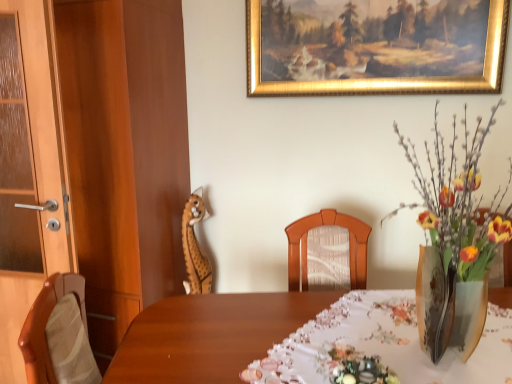
This screenshot has width=512, height=384. What do you see at coordinates (97, 159) in the screenshot?
I see `matte wood dresser at left` at bounding box center [97, 159].

What is the approximate width of wooden door at left?

wooden door at left is 18.51 centimeters in width.

Identify the location of wooden door at left. (30, 171).

You are a GUI agent. You are given a task and a screenshot of the screen. Output one action in this format:
    pyautogui.click(x=<x>, y=<y>)
    Task: Click on the translucent glass vase at right
    This screenshot has height=384, width=512.
    Given the screenshot: What is the action you would take?
    pyautogui.click(x=453, y=236)

The height and width of the screenshot is (384, 512). Find the location of `gold-framed painting at upper center`. gold-framed painting at upper center is located at coordinates (376, 51).

Where is `floral arrangement that is above the wooden door at left (from a real-world perspective)`? The width and height of the screenshot is (512, 384). floral arrangement that is above the wooden door at left (from a real-world perspective) is located at coordinates (453, 236).

Consider the image. Between wooden door at left and translucent glass vase at right, which one appears on the right side from the viewer's perspective?

From the viewer's perspective, translucent glass vase at right appears more on the right side.

Is there a large distance between wooden door at left and translucent glass vase at right?

Yes, wooden door at left is far from translucent glass vase at right.

From the image's perspective, who appears lower, wooden door at left or translucent glass vase at right?

From the image's view, wooden door at left is below.

Considering the positions of objects wooden table at center and wooden door at left in the image provided, who is behind, wooden table at center or wooden door at left?

wooden door at left is further from the camera.

Locate an element on the screen. Image resolution: width=512 pixels, height=384 pixels. table located underneath the wooden door at left (from a real-world perspective) is located at coordinates (209, 335).

From a real-world perspective, between wooden table at center and wooden door at left, who is vertically lower?

From a 3D spatial view, wooden table at center is below.

Which of these two, wooden table at center or wooden door at left, is thinner?

With smaller width is wooden door at left.

In the scene shown: From the image's perspective, which is below, wooden giraffe at upper left or translucent glass vase at right?

wooden giraffe at upper left appears lower in the image.

Find the location of a particular element. The image size is (512, 384). animal located underneath the translucent glass vase at right (from a real-world perspective) is located at coordinates (195, 247).

Does wooden giraffe at upper left touch translucent glass vase at right?

wooden giraffe at upper left and translucent glass vase at right are not in contact.

Looking at their sizes, would you say wooden giraffe at upper left is wider or thinner than translucent glass vase at right?

Considering their sizes, wooden giraffe at upper left looks slimmer than translucent glass vase at right.

Is point (478, 159) less distant than point (336, 292)?

Yes, point (478, 159) is in front of point (336, 292).

Which of these two, translucent glass vase at right or wooden table at center, stands shorter?

wooden table at center.

Considering the sizes of objects translucent glass vase at right and wooden table at center in the image provided, who is thinner, translucent glass vase at right or wooden table at center?

translucent glass vase at right.

Would you say wooden giraffe at upper left is a long distance from wooden table at center?

No, wooden giraffe at upper left is not far from wooden table at center.

The image size is (512, 384). In order to click on table in front of the wooden giraffe at upper left in this screenshot , I will do (x=209, y=335).

Considering the relative sizes of wooden giraffe at upper left and wooden table at center in the image provided, is wooden giraffe at upper left smaller than wooden table at center?

Correct, wooden giraffe at upper left occupies less space than wooden table at center.

Which point is more forward, (193, 199) or (258, 312)?

The point (258, 312) is more forward.

Can you see matte wood dresser at left touching translucent glass vase at right?

No, matte wood dresser at left is not in contact with translucent glass vase at right.

How many degrees apart are the facing directions of matte wood dresser at left and translucent glass vase at right?

matte wood dresser at left and translucent glass vase at right are facing 17.5 degrees away from each other.

Which of these two, matte wood dresser at left or translucent glass vase at right, is thinner?

matte wood dresser at left.

Which of these two, matte wood dresser at left or translucent glass vase at right, is smaller?

Smaller between the two is translucent glass vase at right.

Is matte wood dresser at left closer to the viewer compared to gold-framed painting at upper center?

No, matte wood dresser at left is further to the viewer.

Where is `dresser below the gold-framed painting at upper center (from the image's perspective)`? dresser below the gold-framed painting at upper center (from the image's perspective) is located at coordinates [x=97, y=159].

Considering the sizes of objects matte wood dresser at left and gold-framed painting at upper center in the image provided, who is thinner, matte wood dresser at left or gold-framed painting at upper center?

With smaller width is gold-framed painting at upper center.

Is there a large distance between matte wood dresser at left and gold-framed painting at upper center?

No.

Find the location of a particular element. door on the left side of translucent glass vase at right is located at coordinates (30, 171).

In the image, there is a wooden door at left. Find the location of `table below it (from a real-world perspective)`. table below it (from a real-world perspective) is located at coordinates (209, 335).

From the image, which object appears to be farther from wooden door at left, matte wood dresser at left or wooden table at center?

wooden table at center is positioned further to the anchor wooden door at left.

In the scene shown: Looking at the image, which one is located closer to wooden table at center, wooden giraffe at upper left or matte wood dresser at left?

matte wood dresser at left is positioned closer to the anchor wooden table at center.

Considering their positions, is wooden giraffe at upper left positioned closer to wooden door at left than wooden table at center?

wooden giraffe at upper left.

When comparing their distances from wooden door at left, does gold-framed painting at upper center or translucent glass vase at right seem closer?

Among the two, gold-framed painting at upper center is located nearer to wooden door at left.

From the image, which object appears to be farther from wooden table at center, gold-framed painting at upper center or matte wood dresser at left?

gold-framed painting at upper center is positioned further to the anchor wooden table at center.

From the image, which object appears to be farther from wooden giraffe at upper left, wooden table at center or gold-framed painting at upper center?

Among the two, gold-framed painting at upper center is located further to wooden giraffe at upper left.

Considering their positions, is translucent glass vase at right positioned further to wooden table at center than wooden door at left?

wooden door at left is further to wooden table at center.

When comparing their distances from wooden table at center, does wooden giraffe at upper left or wooden door at left seem further?

The object further to wooden table at center is wooden giraffe at upper left.

This screenshot has height=384, width=512. I want to click on picture frame between wooden table at center and wooden giraffe at upper left from front to back, so pos(376,51).

Identify the location of dresser located between wooden table at center and wooden giraffe at upper left in the depth direction. Image resolution: width=512 pixels, height=384 pixels. (97, 159).

Where is `dresser between wooden door at left and translucent glass vase at right from left to right`? The image size is (512, 384). dresser between wooden door at left and translucent glass vase at right from left to right is located at coordinates (97, 159).

The width and height of the screenshot is (512, 384). Identify the location of dresser located between wooden door at left and wooden giraffe at upper left in the depth direction. (97, 159).